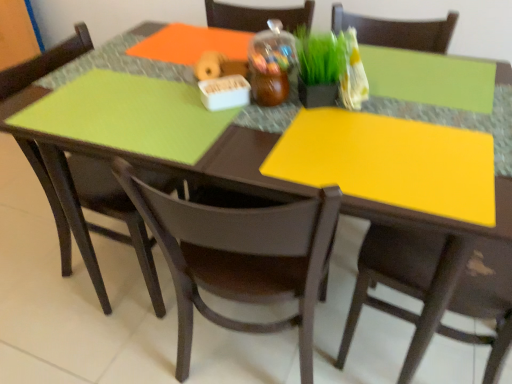
What do you see at coordinates (116, 217) in the screenshot? I see `matte black chair at lower left, marked as the first chair in a left-to-right arrangement` at bounding box center [116, 217].

The image size is (512, 384). Identify the location of matte brown chair at center, the second chair viewed from the right. (239, 258).

Can you tell me how much green matte grass at center and matte black chair at right, marked as the first chair in a right-to-left arrangement, differ in facing direction?

green matte grass at center and matte black chair at right, marked as the first chair in a right-to-left arrangement, are facing 125 degrees away from each other.

Is green matte grass at center oriented towards matte black chair at right, marked as the first chair in a right-to-left arrangement?

No, green matte grass at center is not aimed at matte black chair at right, marked as the first chair in a right-to-left arrangement.

From the image's perspective, would you say green matte grass at center is shown under matte black chair at right, acting as the 3th chair starting from the left?

No.

Is matte brown chair at center, placed as the 2th chair when sorted from left to right, closer to the viewer compared to green matte grass at center?

Yes, matte brown chair at center, placed as the 2th chair when sorted from left to right, is closer to the viewer.

From a real-world perspective, which is physically below, matte brown chair at center, the second chair viewed from the right, or green matte grass at center?

matte brown chair at center, the second chair viewed from the right, from a real-world perspective.

From the image's perspective, is matte brown chair at center, placed as the 2th chair when sorted from left to right, located beneath green matte grass at center?

Yes, from the image's perspective, matte brown chair at center, placed as the 2th chair when sorted from left to right, is below green matte grass at center.

Is matte brown chair at center, placed as the 2th chair when sorted from left to right, beside green matte grass at center?

No, matte brown chair at center, placed as the 2th chair when sorted from left to right, is not next to green matte grass at center.

Is matte brown chair at center, placed as the 2th chair when sorted from left to right, spatially inside matte black chair at right, acting as the 3th chair starting from the left, or outside of it?

The correct answer is: outside.

Is matte brown chair at center, placed as the 2th chair when sorted from left to right, touching matte black chair at right, marked as the first chair in a right-to-left arrangement?

No, matte brown chair at center, placed as the 2th chair when sorted from left to right, is not beside matte black chair at right, marked as the first chair in a right-to-left arrangement.

From their relative heights in the image, would you say matte brown chair at center, placed as the 2th chair when sorted from left to right, is taller or shorter than matte black chair at right, acting as the 3th chair starting from the left?

Clearly, matte brown chair at center, placed as the 2th chair when sorted from left to right, is shorter compared to matte black chair at right, acting as the 3th chair starting from the left.

Are matte brown chair at center, placed as the 2th chair when sorted from left to right, and matte black chair at lower left, which is counted as the 3th chair, starting from the right, far apart?

That's not correct — matte brown chair at center, placed as the 2th chair when sorted from left to right, is a little close to matte black chair at lower left, which is counted as the 3th chair, starting from the right.

From a real-world perspective, is matte brown chair at center, the second chair viewed from the right, located beneath matte black chair at lower left, which is counted as the 3th chair, starting from the right?

No.

Consider the image. From the image's perspective, is matte brown chair at center, placed as the 2th chair when sorted from left to right, above matte black chair at lower left, marked as the first chair in a left-to-right arrangement?

No, from the image's perspective, matte brown chair at center, placed as the 2th chair when sorted from left to right, is not on top of matte black chair at lower left, marked as the first chair in a left-to-right arrangement.

From a real-world perspective, is matte black chair at lower left, marked as the first chair in a left-to-right arrangement, located beneath matte black chair at right, marked as the first chair in a right-to-left arrangement?

Indeed, from a real-world perspective, matte black chair at lower left, marked as the first chair in a left-to-right arrangement, is positioned beneath matte black chair at right, marked as the first chair in a right-to-left arrangement.

Which of these two, matte black chair at lower left, marked as the first chair in a left-to-right arrangement, or matte black chair at right, marked as the first chair in a right-to-left arrangement, is bigger?

With larger size is matte black chair at right, marked as the first chair in a right-to-left arrangement.

Which is less distant, (x=15, y=79) or (x=478, y=282)?

The point (x=478, y=282) is in front.

Looking at this image, considering the sizes of objects matte black chair at lower left, marked as the first chair in a left-to-right arrangement, and matte black chair at right, acting as the 3th chair starting from the left, in the image provided, who is shorter, matte black chair at lower left, marked as the first chair in a left-to-right arrangement, or matte black chair at right, acting as the 3th chair starting from the left,?

Standing shorter between the two is matte black chair at lower left, marked as the first chair in a left-to-right arrangement.

From the image's perspective, is matte black chair at right, marked as the first chair in a right-to-left arrangement, beneath matte black chair at lower left, which is counted as the 3th chair, starting from the right?

Yes, from the image's perspective, matte black chair at right, marked as the first chair in a right-to-left arrangement, is below matte black chair at lower left, which is counted as the 3th chair, starting from the right.

Is matte black chair at right, marked as the first chair in a right-to-left arrangement, in front of or behind matte black chair at lower left, which is counted as the 3th chair, starting from the right, in the image?

Clearly, matte black chair at right, marked as the first chair in a right-to-left arrangement, is in front of matte black chair at lower left, which is counted as the 3th chair, starting from the right.

Is point (449, 308) closer or farther from the camera than point (42, 179)?

Clearly, point (449, 308) is closer to the camera than point (42, 179).

Is matte black chair at lower left, marked as the first chair in a left-to-right arrangement, a part of matte black chair at right, marked as the first chair in a right-to-left arrangement?

Actually, matte black chair at lower left, marked as the first chair in a left-to-right arrangement, is outside matte black chair at right, marked as the first chair in a right-to-left arrangement.

Is matte black chair at right, acting as the 3th chair starting from the left, positioned in front of green matte grass at center?

Yes, it is in front of green matte grass at center.

From the image's perspective, is matte black chair at right, acting as the 3th chair starting from the left, positioned above or below green matte grass at center?

Based on their image positions, matte black chair at right, acting as the 3th chair starting from the left, is located beneath green matte grass at center.

From a real-world perspective, is matte black chair at right, acting as the 3th chair starting from the left, positioned over green matte grass at center based on gravity?

No, from a real-world perspective, matte black chair at right, acting as the 3th chair starting from the left, is not above green matte grass at center.

In the scene shown: Is matte black chair at right, acting as the 3th chair starting from the left, bigger than green matte grass at center?

Correct, matte black chair at right, acting as the 3th chair starting from the left, is larger in size than green matte grass at center.

Where is `grass above the matte black chair at right, marked as the first chair in a right-to-left arrangement (from a real-world perspective)`? grass above the matte black chair at right, marked as the first chair in a right-to-left arrangement (from a real-world perspective) is located at coordinates [320, 57].

Find the location of a particular element. chair that is the 2nd object located below the green matte grass at center (from the image's perspective) is located at coordinates (239, 258).

From the picture: When comparing their distances from green matte grass at center, does matte brown chair at center, placed as the 2th chair when sorted from left to right, or matte black chair at right, acting as the 3th chair starting from the left, seem further?

matte black chair at right, acting as the 3th chair starting from the left, lies further to green matte grass at center than the other object.

Considering their positions, is matte black chair at lower left, which is counted as the 3th chair, starting from the right, positioned closer to matte black chair at right, acting as the 3th chair starting from the left, than matte brown chair at center, the second chair viewed from the right?

matte brown chair at center, the second chair viewed from the right, is positioned closer to the anchor matte black chair at right, acting as the 3th chair starting from the left.

Estimate the real-world distances between objects in this image. Which object is closer to green matte grass at center, matte black chair at lower left, which is counted as the 3th chair, starting from the right, or matte black chair at right, acting as the 3th chair starting from the left?

Result: matte black chair at right, acting as the 3th chair starting from the left, is closer to green matte grass at center.

From the image, which object appears to be farther from green matte grass at center, matte brown chair at center, the second chair viewed from the right, or matte black chair at lower left, which is counted as the 3th chair, starting from the right?

matte black chair at lower left, which is counted as the 3th chair, starting from the right.

Which object lies nearer to the anchor point matte black chair at lower left, which is counted as the 3th chair, starting from the right, green matte grass at center or matte black chair at right, marked as the first chair in a right-to-left arrangement?

green matte grass at center.

Based on their spatial positions, is green matte grass at center or matte brown chair at center, placed as the 2th chair when sorted from left to right, closer to matte black chair at right, marked as the first chair in a right-to-left arrangement?

matte brown chair at center, placed as the 2th chair when sorted from left to right, is positioned closer to the anchor matte black chair at right, marked as the first chair in a right-to-left arrangement.

Based on their spatial positions, is matte brown chair at center, the second chair viewed from the right, or matte black chair at lower left, which is counted as the 3th chair, starting from the right, closer to matte black chair at right, marked as the first chair in a right-to-left arrangement?

The object closer to matte black chair at right, marked as the first chair in a right-to-left arrangement, is matte brown chair at center, the second chair viewed from the right.

Looking at the image, which one is located closer to matte black chair at lower left, marked as the first chair in a left-to-right arrangement, matte black chair at right, marked as the first chair in a right-to-left arrangement, or green matte grass at center?

Based on the image, green matte grass at center appears to be nearer to matte black chair at lower left, marked as the first chair in a left-to-right arrangement.

Find the location of a particular element. Image resolution: width=512 pixels, height=384 pixels. grass between matte black chair at lower left, which is counted as the 3th chair, starting from the right, and matte black chair at right, acting as the 3th chair starting from the left, from left to right is located at coordinates (320, 57).

You are a GUI agent. You are given a task and a screenshot of the screen. Output one action in this format:
    pyautogui.click(x=<x>, y=<y>)
    Task: Click on the chair situated between matte black chair at lower left, marked as the first chair in a left-to-right arrangement, and green matte grass at center from left to right
    
    Given the screenshot: What is the action you would take?
    pyautogui.click(x=239, y=258)

Locate an element on the screen. This screenshot has width=512, height=384. grass between matte brown chair at center, the second chair viewed from the right, and matte black chair at right, marked as the first chair in a right-to-left arrangement, in the horizontal direction is located at coordinates (320, 57).

Identify the location of chair between matte black chair at lower left, which is counted as the 3th chair, starting from the right, and matte black chair at right, marked as the first chair in a right-to-left arrangement, from left to right. (239, 258).